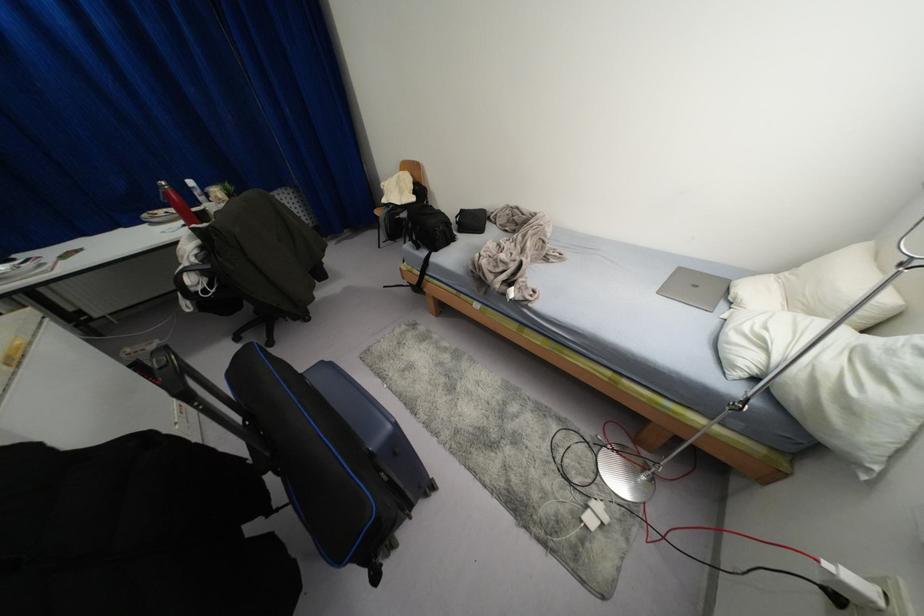
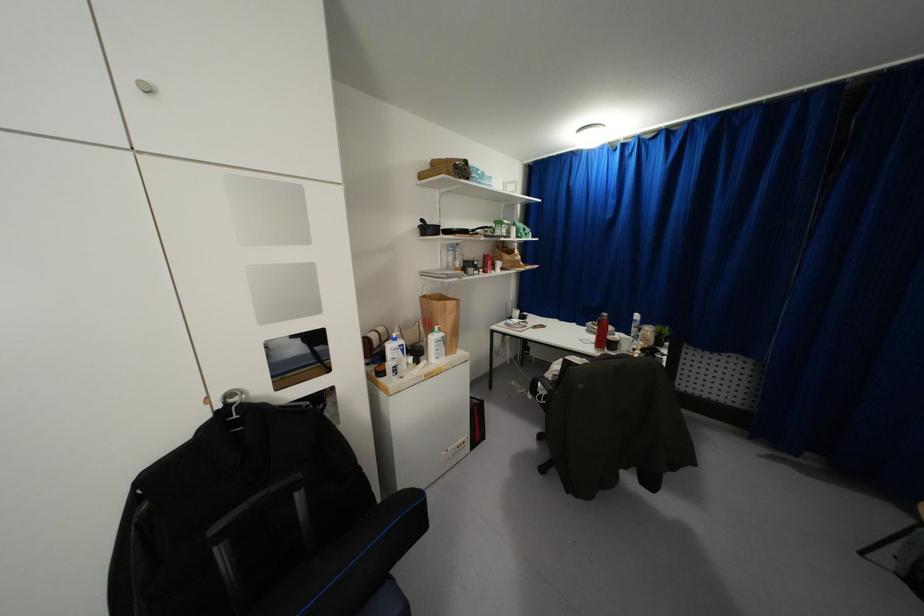
Question: The camera is either moving clockwise (left) or counter-clockwise (right) around the object. The first image is from the beginning of the video and the second image is from the end. Is the camera moving left or right when shooting the video?

Choices:
 (A) Left
 (B) Right

Answer: (B)